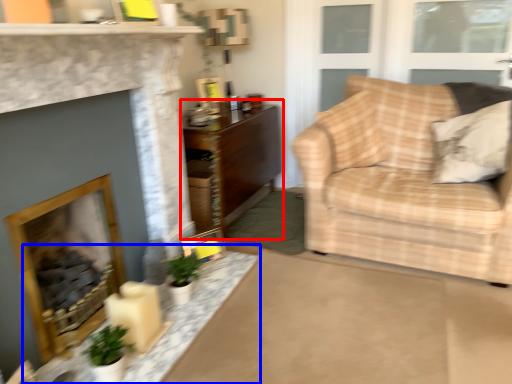
Question: Which object is further to the camera taking this photo, table (highlighted by a red box) or table (highlighted by a blue box)?

Choices:
 (A) table
 (B) table

Answer: (A)